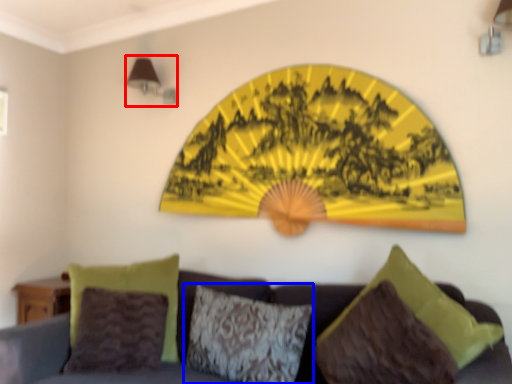
Question: Among these objects, which one is farthest to the camera, lamp (highlighted by a red box) or pillow (highlighted by a blue box)?

Choices:
 (A) lamp
 (B) pillow

Answer: (A)